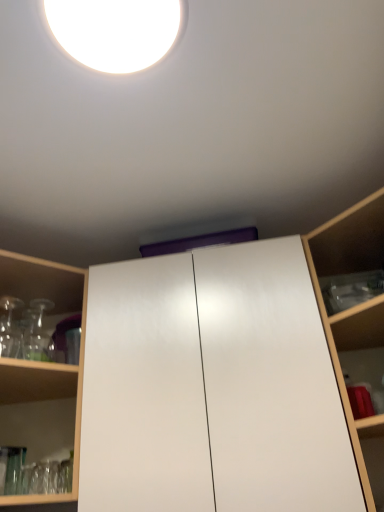
Question: Visually, is wooden shelf at right, the 1th shelf from the right, positioned to the left or to the right of transparent glassware at left, the second shelf from the right?

Choices:
 (A) left
 (B) right

Answer: (B)

Question: Is wooden shelf at right, the 2th shelf when ordered from left to right, wider or thinner than transparent glassware at left, arranged as the first shelf when viewed from the left?

Choices:
 (A) wide
 (B) thin

Answer: (B)

Question: Estimate the real-world distances between objects in this image. Which object is closer to the transparent glassware at left, the second shelf from the right?

Choices:
 (A) wooden shelf at right, the 1th shelf from the right
 (B) white glossy cabinet at center
 (C) white glossy droplight at upper center

Answer: (A)

Question: Considering the real-world distances, which object is farthest from the white glossy droplight at upper center?

Choices:
 (A) wooden shelf at right, the 2th shelf when ordered from left to right
 (B) white glossy cabinet at center
 (C) transparent glassware at left, the second shelf from the right

Answer: (A)